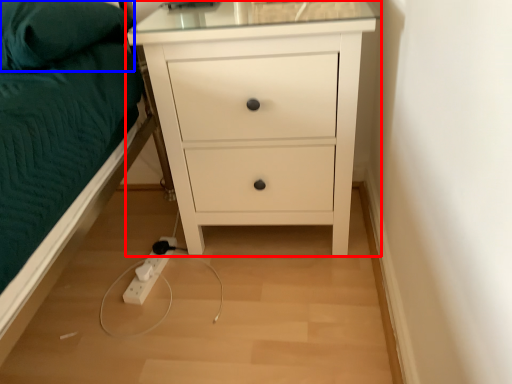
Question: Among these objects, which one is nearest to the camera, chest of drawers (highlighted by a red box) or pillow (highlighted by a blue box)?

Choices:
 (A) chest of drawers
 (B) pillow

Answer: (B)